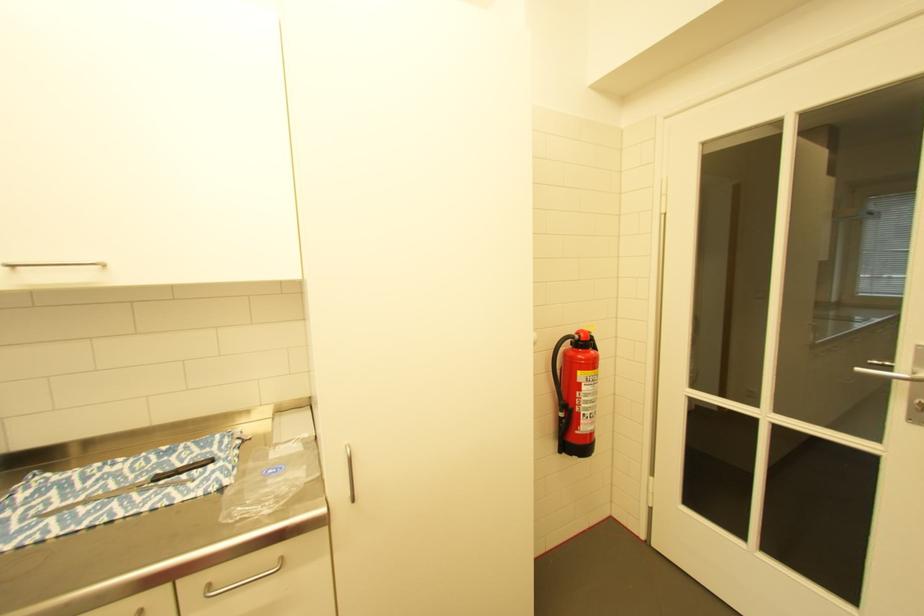
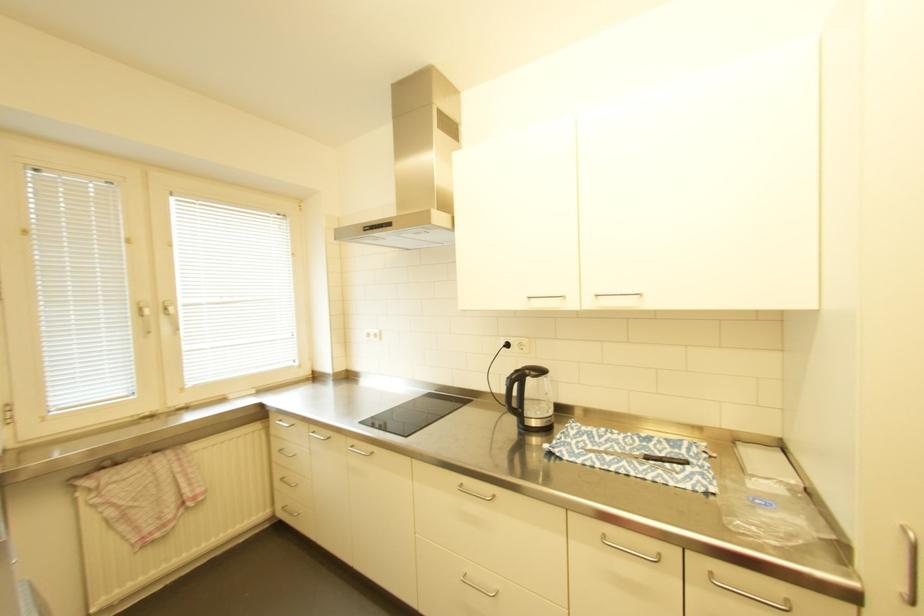
Question: Based on the continuous images, in which direction is the camera rotating? Reply with the corresponding letter.

Choices:
 (A) Left
 (B) Right
 (C) Up
 (D) Down

Answer: (A)